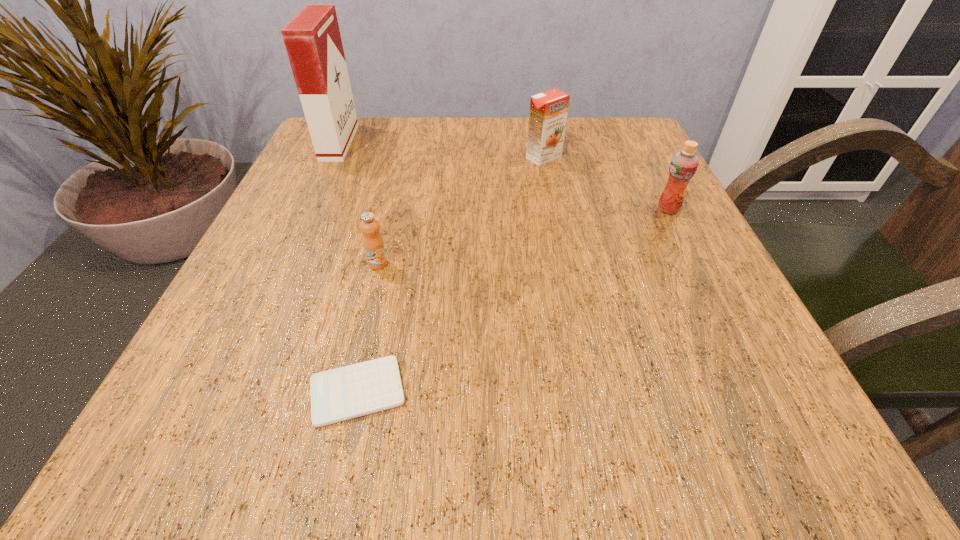
Locate an element on the screen. The image size is (960, 540). vacant space that satisfies the following two spatial constraints: 1. on the front-facing side of the leftmost object; 2. on the left side of the second nearest orange juice is located at coordinates (309, 209).

In order to click on free location that satisfies the following two spatial constraints: 1. on the front-facing side of the shortest object; 2. on the left side of the cigarette_case in this screenshot , I will do `click(226, 392)`.

Where is `free location that satisfies the following two spatial constraints: 1. on the front side of the second object from right to left; 2. on the right side of the rightmost object`? The image size is (960, 540). free location that satisfies the following two spatial constraints: 1. on the front side of the second object from right to left; 2. on the right side of the rightmost object is located at coordinates (554, 209).

Locate an element on the screen. This screenshot has height=540, width=960. vacant area in the image that satisfies the following two spatial constraints: 1. on the back side of the second object from right to left; 2. on the front-facing side of the leftmost object is located at coordinates (540, 143).

What are the coordinates of `free space that satisfies the following two spatial constraints: 1. on the front-facing side of the cigarette_case; 2. on the right side of the third farthest object` in the screenshot? It's located at (309, 209).

You are a GUI agent. You are given a task and a screenshot of the screen. Output one action in this format:
    pyautogui.click(x=<x>, y=<y>)
    Task: Click on the free location that satisfies the following two spatial constraints: 1. on the front-facing side of the tallest object; 2. on the back side of the farthest orange juice
    This screenshot has height=540, width=960.
    Given the screenshot: What is the action you would take?
    pyautogui.click(x=333, y=157)